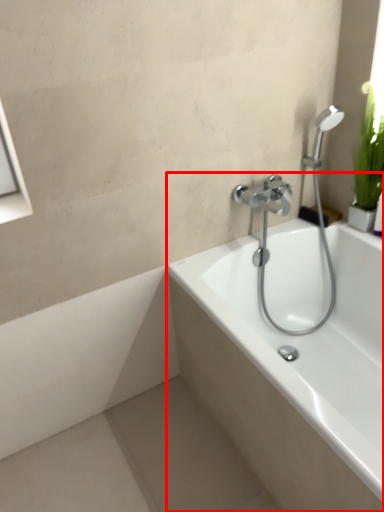
Question: In this image, where is bathtub (annotated by the red box) located relative to plumbing fixture?

Choices:
 (A) right
 (B) left

Answer: (A)